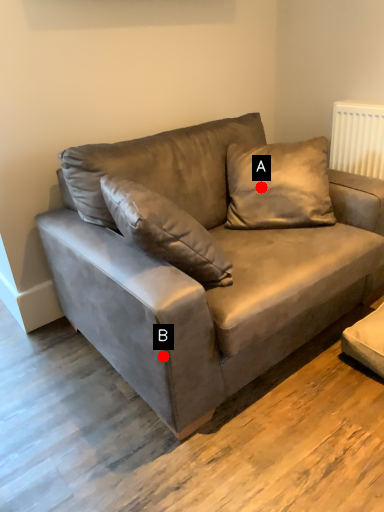
Question: Two points are circled on the image, labeled by A and B beside each circle. Which of the following is the closest to the observer?

Choices:
 (A) A is closer
 (B) B is closer

Answer: (B)